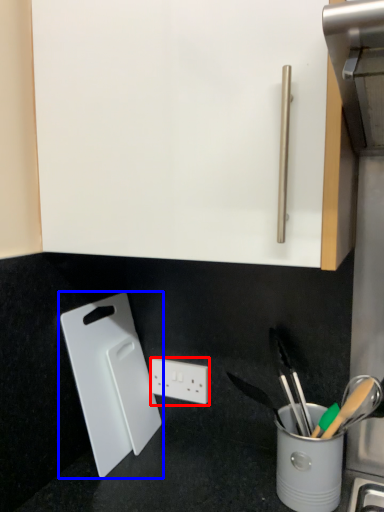
Question: Among these objects, which one is nearest to the camera, power plugs and sockets (highlighted by a red box) or cutting board (highlighted by a blue box)?

Choices:
 (A) power plugs and sockets
 (B) cutting board

Answer: (B)